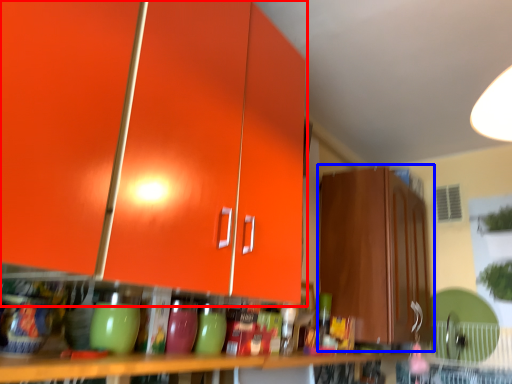
Question: Which object is further to the camera taking this photo, cabinetry (highlighted by a red box) or cabinetry (highlighted by a blue box)?

Choices:
 (A) cabinetry
 (B) cabinetry

Answer: (B)